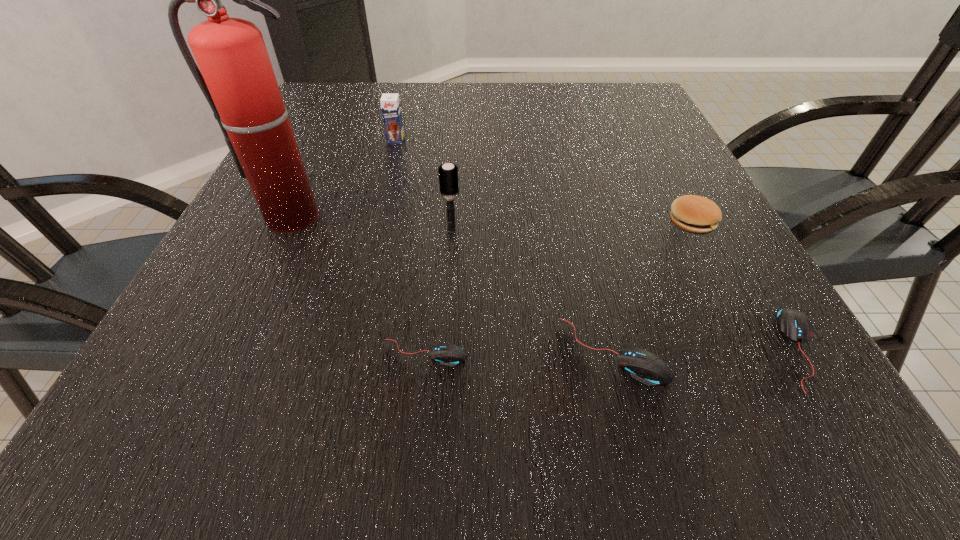
You are a GUI agent. You are given a task and a screenshot of the screen. Output one action in this format:
    pyautogui.click(x=<x>, y=<y>)
    Task: Click on the free area in between the leftmost object and the rightmost mouse
    This screenshot has height=540, width=960.
    Given the screenshot: What is the action you would take?
    pyautogui.click(x=547, y=282)

At what (x,y) coordinates should I click in order to perform the action: click on empty location between the second tallest mouse and the tallest object. Please return your answer as a coordinate pair (x, y). This screenshot has height=540, width=960. Looking at the image, I should click on (547, 282).

Identify the location of empty location between the second tallest mouse and the fifth object from left to right. (707, 350).

Identify the location of vacant point located between the farthest object and the hairbrush. (423, 185).

Where is `empty space between the second shortest object and the fire extinguisher`? The width and height of the screenshot is (960, 540). empty space between the second shortest object and the fire extinguisher is located at coordinates (547, 282).

The height and width of the screenshot is (540, 960). What are the coordinates of `vacant area between the rightmost mouse and the fire extinguisher` in the screenshot? It's located at (547, 282).

Identify the location of vacant area between the hairbrush and the shortest object. The width and height of the screenshot is (960, 540). (439, 292).

Select which object is the sixth closest to the second shortest mouse. Please provide its 2D coordinates. Your answer should be formatted as a tuple, i.e. [(x, y)], where the tuple contains the x and y coordinates of a point satisfying the conditions above.

[(390, 104)]

Select which object appears as the third closest to the tallest object. Please provide its 2D coordinates. Your answer should be formatted as a tuple, i.e. [(x, y)], where the tuple contains the x and y coordinates of a point satisfying the conditions above.

[(448, 354)]

The image size is (960, 540). What are the coordinates of `mouse identified as the third closest to the chocolate milk` in the screenshot? It's located at (794, 325).